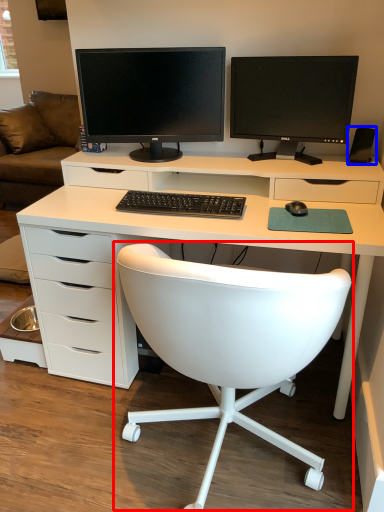
Question: Among these objects, which one is farthest to the camera, chair (highlighted by a red box) or speaker (highlighted by a blue box)?

Choices:
 (A) chair
 (B) speaker

Answer: (B)